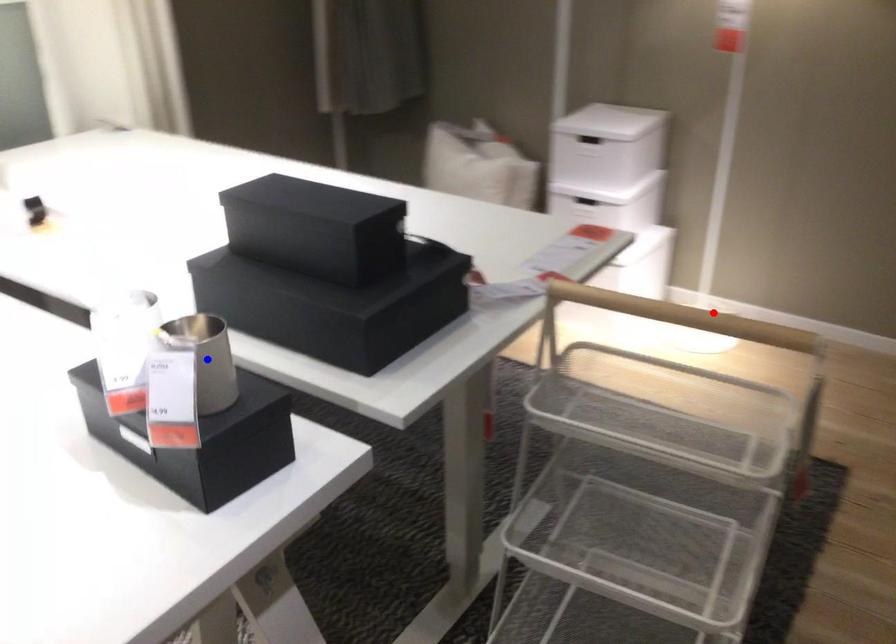
Question: In the image, two points are highlighted. Which point is nearer to the camera? Reply with the corresponding letter.

Choices:
 (A) blue point
 (B) red point

Answer: (A)